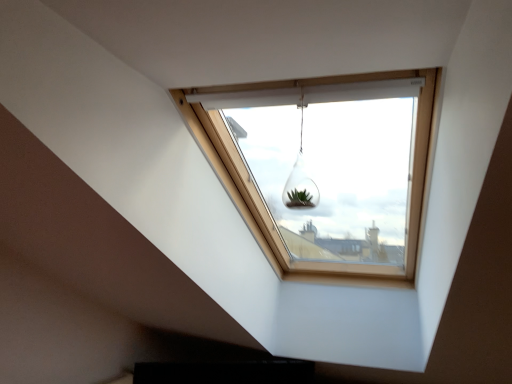
Find the location of `transparent glass terrarium at center`. transparent glass terrarium at center is located at coordinates (300, 179).

The height and width of the screenshot is (384, 512). Describe the element at coordinates (300, 179) in the screenshot. I see `transparent glass terrarium at center` at that location.

Locate an element on the screen. transparent glass terrarium at center is located at coordinates point(300,179).